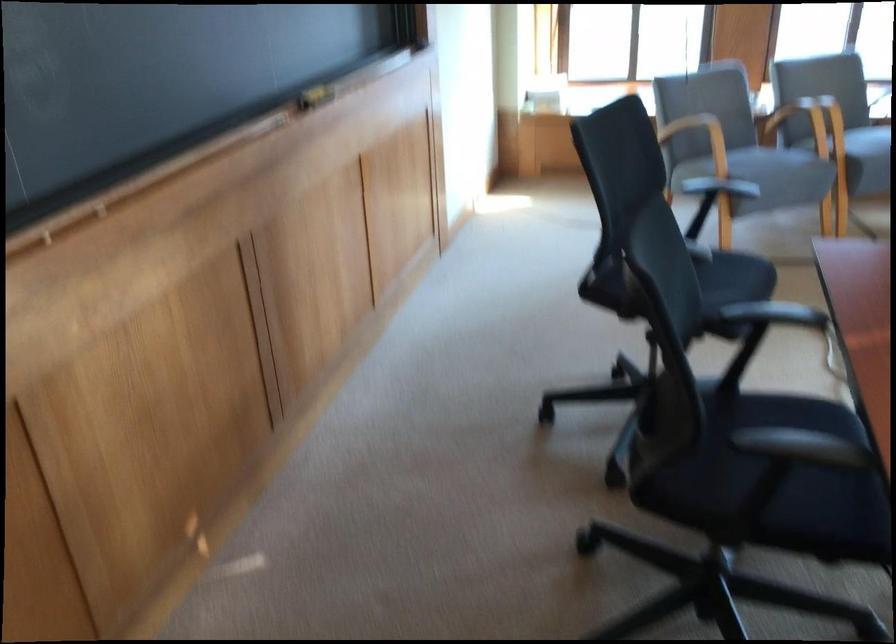
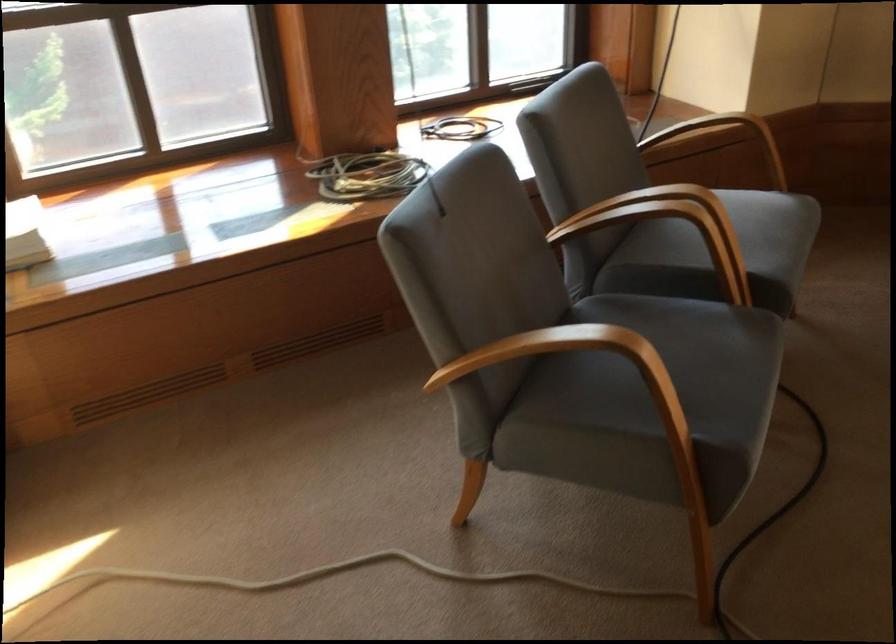
Where in the second image is the point corresponding to the point at 726,142 from the first image?

(591, 375)